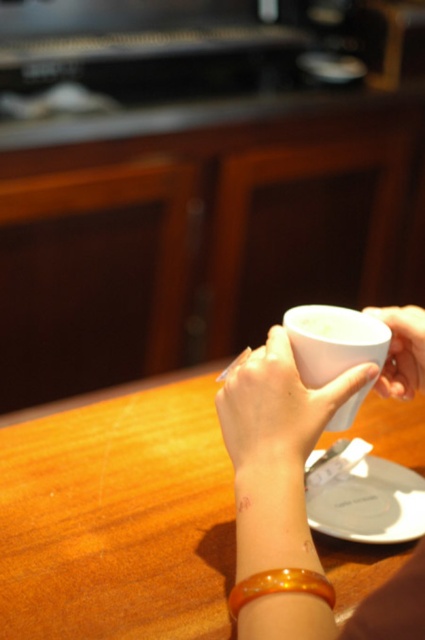
Is white glossy mug at lower center bigger than orange translucent bangle at lower center?

Correct, white glossy mug at lower center is larger in size than orange translucent bangle at lower center.

Is white glossy mug at lower center positioned before orange translucent bangle at lower center?

No, it is behind orange translucent bangle at lower center.

Does point (337, 330) lie behind point (274, 589)?

Yes, it is.

Locate an element on the screen. The width and height of the screenshot is (425, 640). white glossy mug at lower center is located at coordinates (334, 340).

Is white glossy cup at right to the right of orange translucent bangle at lower center from the viewer's perspective?

Yes, white glossy cup at right is to the right of orange translucent bangle at lower center.

Does white glossy cup at right have a lesser height compared to orange translucent bangle at lower center?

No.

Find the location of a particular element. white glossy cup at right is located at coordinates (402, 352).

Can you confirm if wooden table at center is positioned below orange translucent bangle at lower center?

No, wooden table at center is not below orange translucent bangle at lower center.

Identify the location of wooden table at center. (118, 520).